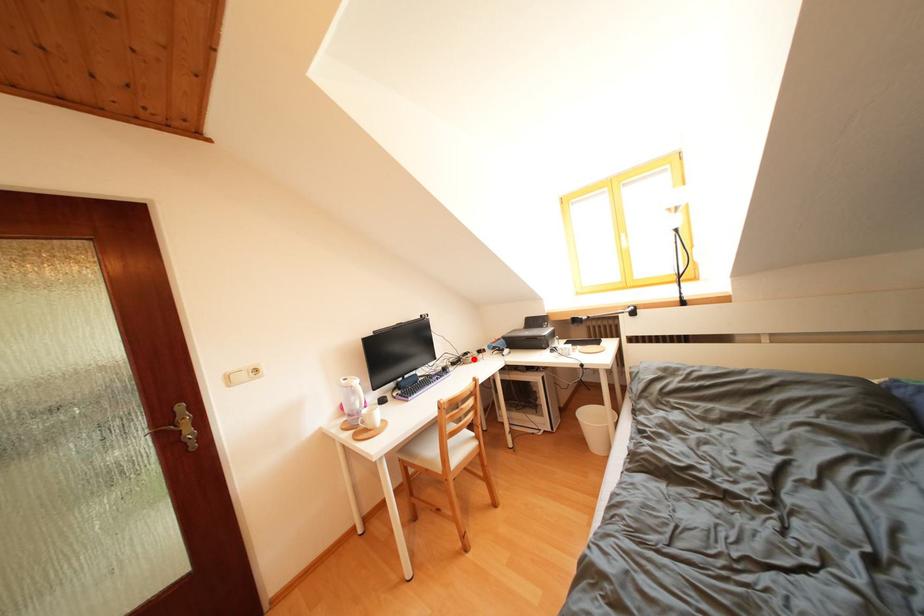
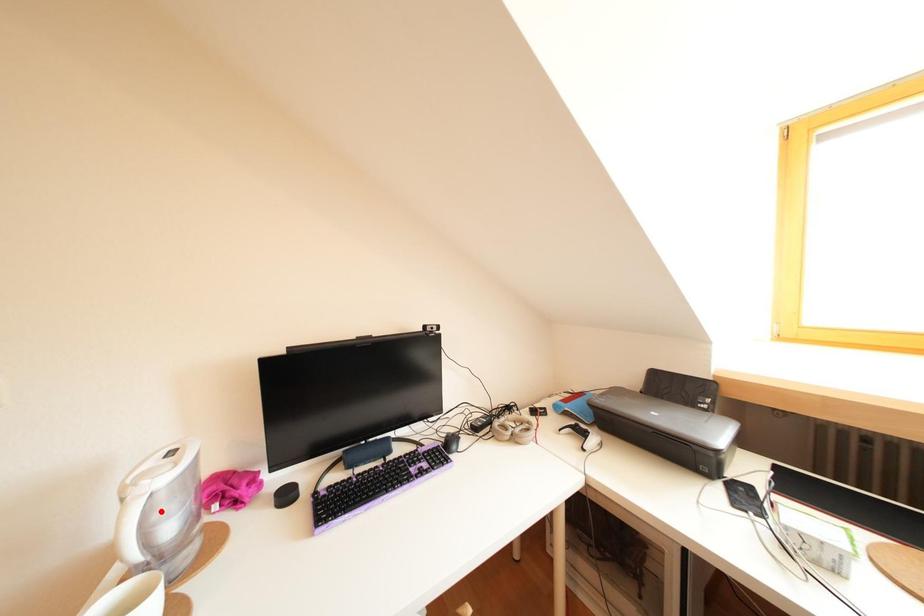
I am providing you with two images of the same scene from different viewpoints. A red point is marked on the first image and another point is marked on the second image. Is the red point in image1 aligned with the point shown in image2?

No